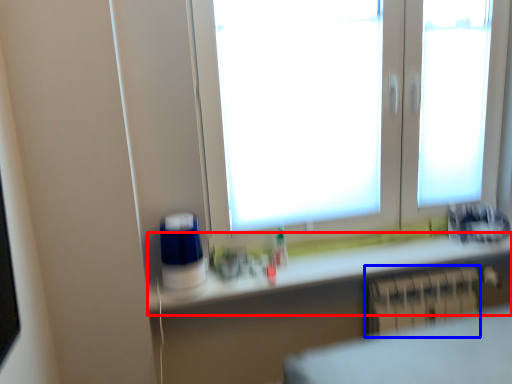
Question: Which of the following is the farthest to the observer, counter top (highlighted by a red box) or radiator (highlighted by a blue box)?

Choices:
 (A) counter top
 (B) radiator

Answer: (B)